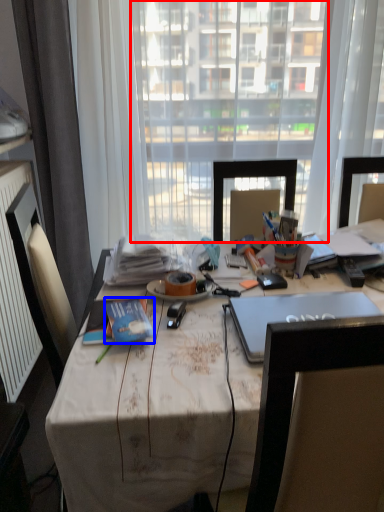
Question: Which point is closer to the camera, window screen (highlighted by a red box) or book (highlighted by a blue box)?

Choices:
 (A) window screen
 (B) book

Answer: (B)